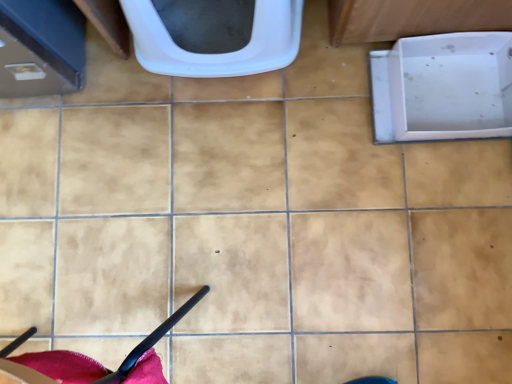
Measure the distance between point (409, 133) and camera.

Point (409, 133) and camera are 1.10 meters apart from each other.

The height and width of the screenshot is (384, 512). Find the location of `white plastic bath at right`. white plastic bath at right is located at coordinates (443, 87).

What do you see at coordinates (443, 87) in the screenshot? I see `white plastic bath at right` at bounding box center [443, 87].

Describe the element at coordinates (218, 53) in the screenshot. I see `white plastic toilet at upper center` at that location.

The image size is (512, 384). I want to click on white plastic toilet at upper center, so click(218, 53).

This screenshot has height=384, width=512. What are the coordinates of `white plastic bath at right` in the screenshot? It's located at (443, 87).

Visually, is white plastic bath at right positioned to the left or to the right of white plastic toilet at upper center?

Based on their positions, white plastic bath at right is located to the right of white plastic toilet at upper center.

Considering the positions of objects white plastic bath at right and white plastic toilet at upper center in the image provided, who is in front, white plastic bath at right or white plastic toilet at upper center?

white plastic toilet at upper center.

Considering the positions of point (463, 41) and point (282, 53), is point (463, 41) closer or farther from the camera than point (282, 53)?

Point (463, 41) is positioned farther from the camera compared to point (282, 53).

From the image's perspective, is white plastic bath at right below white plastic toilet at upper center?

Yes.

From a real-world perspective, who is located higher, white plastic bath at right or white plastic toilet at upper center?

From a 3D spatial view, white plastic toilet at upper center is above.

Consider the image. Considering the relative sizes of white plastic bath at right and white plastic toilet at upper center in the image provided, is white plastic bath at right thinner than white plastic toilet at upper center?

In fact, white plastic bath at right might be wider than white plastic toilet at upper center.

Is white plastic bath at right taller or shorter than white plastic toilet at upper center?

white plastic bath at right is shorter than white plastic toilet at upper center.

Does white plastic bath at right have a larger size compared to white plastic toilet at upper center?

Incorrect, white plastic bath at right is not larger than white plastic toilet at upper center.

Is white plastic bath at right situated inside white plastic toilet at upper center or outside?

white plastic bath at right is spatially situated outside white plastic toilet at upper center.

Would you consider white plastic bath at right to be distant from white plastic toilet at upper center?

No, white plastic bath at right is not far away from white plastic toilet at upper center.

Does white plastic bath at right turn towards white plastic toilet at upper center?

No, white plastic bath at right is not aimed at white plastic toilet at upper center.

What's the angular difference between white plastic bath at right and white plastic toilet at upper center's facing directions?

They differ by 83.4 degrees in their facing directions.

What are the coordinates of `bath below the white plastic toilet at upper center (from the image's perspective)` in the screenshot? It's located at (x=443, y=87).

Considering the relative positions of white plastic toilet at upper center and white plastic bath at right in the image provided, is white plastic toilet at upper center to the left of white plastic bath at right from the viewer's perspective?

Yes, white plastic toilet at upper center is to the left of white plastic bath at right.

Is the position of white plastic toilet at upper center less distant than that of white plastic bath at right?

Yes, white plastic toilet at upper center is closer to the camera.

Is point (262, 70) farther from camera compared to point (487, 128)?

No, (262, 70) is closer to viewer.

From the image's perspective, is white plastic toilet at upper center under white plastic bath at right?

No, from the image's perspective, white plastic toilet at upper center is not beneath white plastic bath at right.

From a real-world perspective, is white plastic toilet at upper center positioned above or below white plastic bath at right?

white plastic toilet at upper center is situated higher than white plastic bath at right in the real world.

Considering the relative sizes of white plastic toilet at upper center and white plastic bath at right in the image provided, is white plastic toilet at upper center wider than white plastic bath at right?

In fact, white plastic toilet at upper center might be narrower than white plastic bath at right.

Looking at this image, considering the relative sizes of white plastic toilet at upper center and white plastic bath at right in the image provided, is white plastic toilet at upper center taller than white plastic bath at right?

Indeed, white plastic toilet at upper center has a greater height compared to white plastic bath at right.

Considering the sizes of white plastic toilet at upper center and white plastic bath at right in the image, is white plastic toilet at upper center bigger or smaller than white plastic bath at right?

In the image, white plastic toilet at upper center appears to be larger than white plastic bath at right.

Which is correct: white plastic toilet at upper center is inside white plastic bath at right, or outside of it?

white plastic toilet at upper center is not enclosed by white plastic bath at right.

Are white plastic toilet at upper center and white plastic bath at right located far from each other?

white plastic toilet at upper center is actually quite close to white plastic bath at right.

Consider the image. Is white plastic toilet at upper center oriented towards white plastic bath at right?

No, white plastic toilet at upper center is not oriented towards white plastic bath at right.

Can you tell me how much white plastic toilet at upper center and white plastic bath at right differ in facing direction?

The angular difference between white plastic toilet at upper center and white plastic bath at right is 83.4 degrees.

Identify the location of bath to the right of white plastic toilet at upper center. The height and width of the screenshot is (384, 512). (443, 87).

At what (x,y) coordinates should I click in order to perform the action: click on bath directly beneath the white plastic toilet at upper center (from a real-world perspective). Please return your answer as a coordinate pair (x, y). The width and height of the screenshot is (512, 384). Looking at the image, I should click on (443, 87).

Find the location of a particular element. bath below the white plastic toilet at upper center (from the image's perspective) is located at coordinates (443, 87).